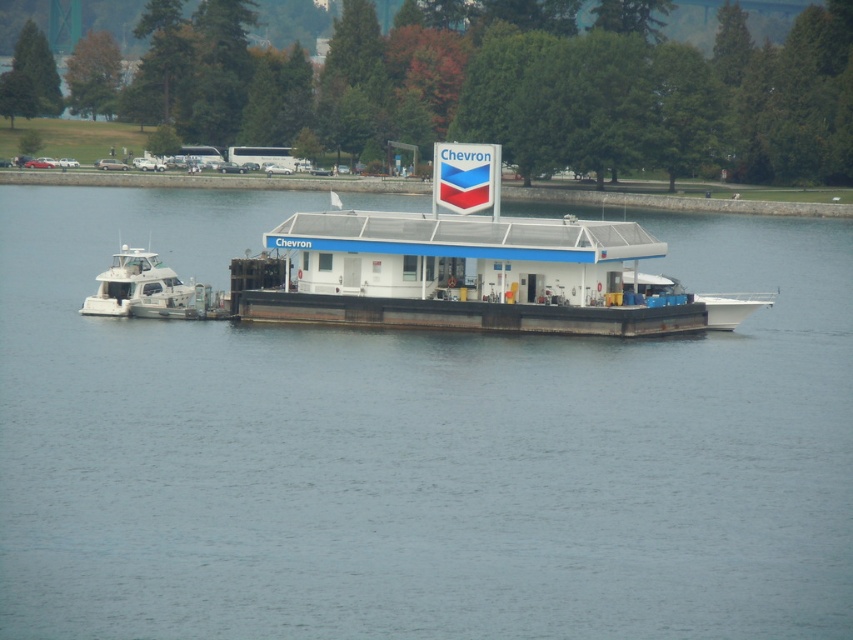
Question: Does white matte water at center come behind white glossy boat at left?

Choices:
 (A) yes
 (B) no

Answer: (B)

Question: Where is white matte water at center located in relation to white glossy boat at left in the image?

Choices:
 (A) right
 (B) left

Answer: (A)

Question: Which point is farther from the camera taking this photo?

Choices:
 (A) (144, 298)
 (B) (265, 422)

Answer: (A)

Question: Which object appears closest to the camera in this image?

Choices:
 (A) white glossy boat at left
 (B) white matte water at center

Answer: (B)

Question: Is white matte water at center further to the viewer compared to white glossy boat at left?

Choices:
 (A) no
 (B) yes

Answer: (A)